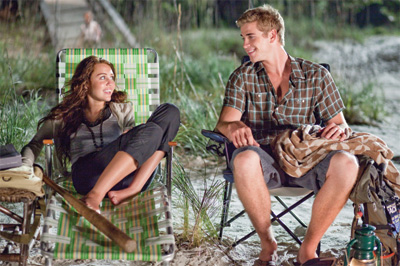
Where is `folding chair`? folding chair is located at coordinates (231, 195).